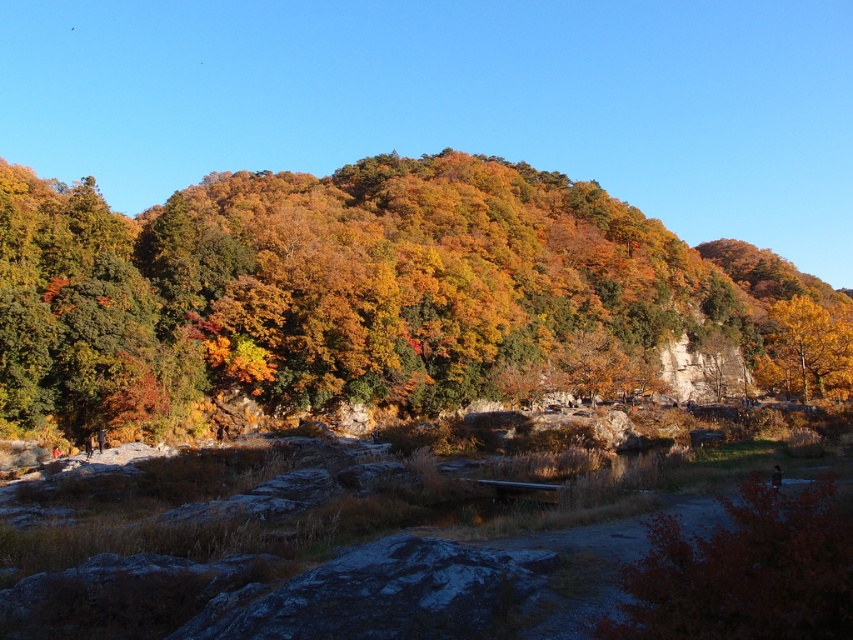
Which is more to the right, shiny red bush at lower right or golden yellow leaves at upper right?

From the viewer's perspective, golden yellow leaves at upper right appears more on the right side.

Which is below, shiny red bush at lower right or golden yellow leaves at upper right?

shiny red bush at lower right

Which is behind, point (767, 536) or point (817, 392)?

Point (817, 392)

Where is `shiny red bush at lower right`? The height and width of the screenshot is (640, 853). shiny red bush at lower right is located at coordinates tap(744, 572).

Who is lower down, autumn leaves at center or golden yellow leaves at upper right?

golden yellow leaves at upper right

Does autumn leaves at center have a lesser width compared to golden yellow leaves at upper right?

Incorrect, autumn leaves at center's width is not less than golden yellow leaves at upper right's.

Between point (523, 396) and point (773, 321), which one is positioned behind?

Positioned behind is point (773, 321).

You are a GUI agent. You are given a task and a screenshot of the screen. Output one action in this format:
    pyautogui.click(x=<x>, y=<y>)
    Task: Click on the autumn leaves at center
    This screenshot has height=640, width=853.
    Given the screenshot: What is the action you would take?
    pyautogui.click(x=351, y=291)

Is autumn leaves at center in front of shiny red bush at lower right?

No, autumn leaves at center is behind shiny red bush at lower right.

Between point (579, 189) and point (712, 545), which one is positioned in front?

Point (712, 545) is more forward.

This screenshot has width=853, height=640. I want to click on autumn leaves at center, so click(x=351, y=291).